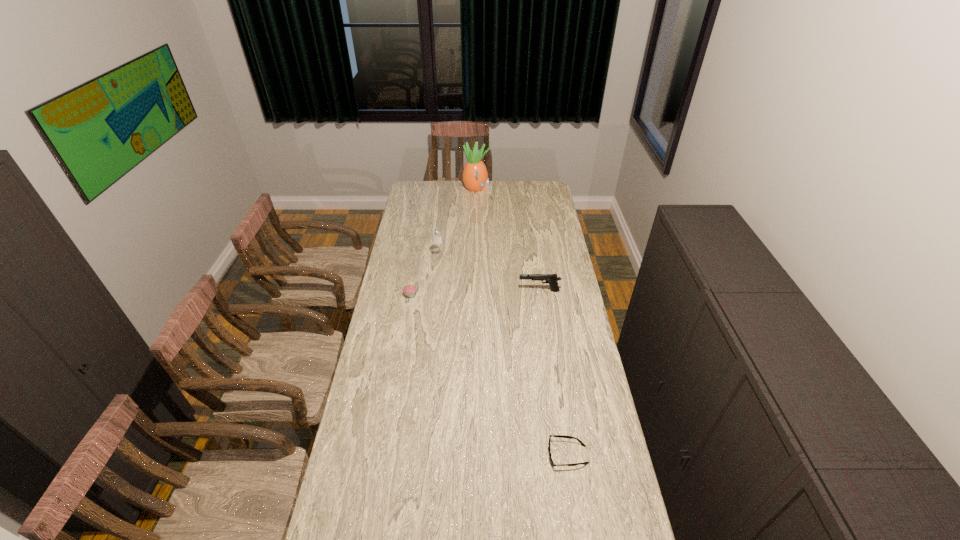
This screenshot has height=540, width=960. In order to click on gun that is positioned at the right edge in this screenshot , I will do `click(551, 279)`.

The width and height of the screenshot is (960, 540). What are the coordinates of `sunglasses present at the right edge` in the screenshot? It's located at (560, 436).

In the image, there is a desktop. Identify the location of vacant space at the far edge. (441, 187).

At what (x,y) coordinates should I click in order to perform the action: click on free region at the left edge. Please return your answer as a coordinate pair (x, y). The image size is (960, 540). Looking at the image, I should click on (419, 207).

I want to click on free spot at the right edge of the desktop, so click(x=552, y=238).

This screenshot has width=960, height=540. I want to click on vacant space at the far right corner of the desktop, so [x=527, y=181].

Where is `free point between the cupcake and the gun`? free point between the cupcake and the gun is located at coordinates (475, 293).

This screenshot has width=960, height=540. I want to click on free area in between the third object from right to left and the sunglasses, so click(522, 322).

Identify the location of free area in between the water bottle and the gun. (489, 274).

Locate an element on the screen. vacant point located between the fourth object from right to left and the fourth tallest object is located at coordinates (424, 276).